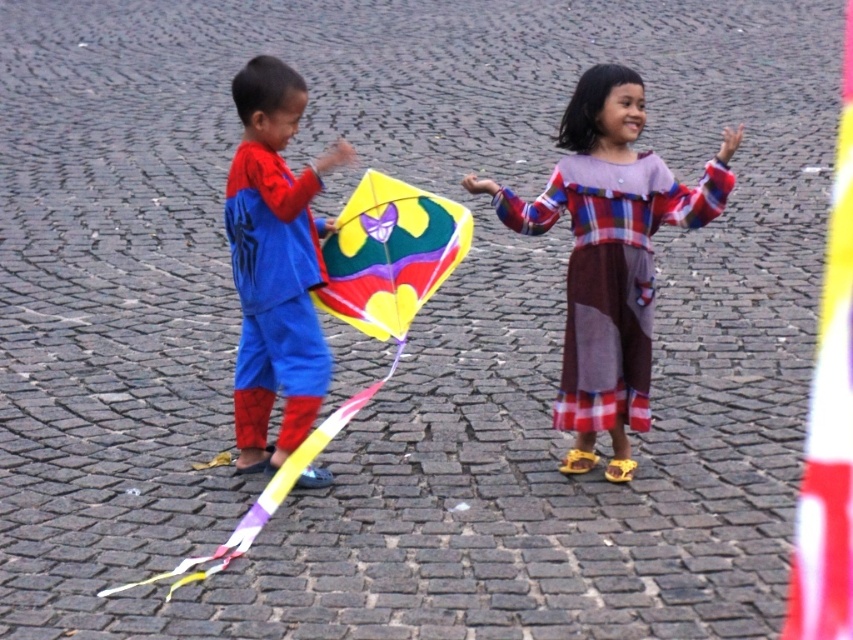
Question: Is plaid cotton dress at center positioned at the back of matte blue pants at left?

Choices:
 (A) yes
 (B) no

Answer: (B)

Question: In this image, where is plaid cotton dress at center located relative to matte blue pants at left?

Choices:
 (A) right
 (B) left

Answer: (A)

Question: Estimate the real-world distances between objects in this image. Which object is farther from the plaid cotton dress at center?

Choices:
 (A) matte blue pants at left
 (B) multicolored paper kite at center

Answer: (A)

Question: Which point appears closest to the camera in this image?

Choices:
 (A) click(x=572, y=195)
 (B) click(x=247, y=540)

Answer: (B)

Question: Which point appears closest to the camera in this image?

Choices:
 (A) (531, 205)
 (B) (242, 406)
 (C) (401, 336)

Answer: (C)

Question: Is plaid cotton dress at center below multicolored paper kite at center?

Choices:
 (A) yes
 (B) no

Answer: (A)